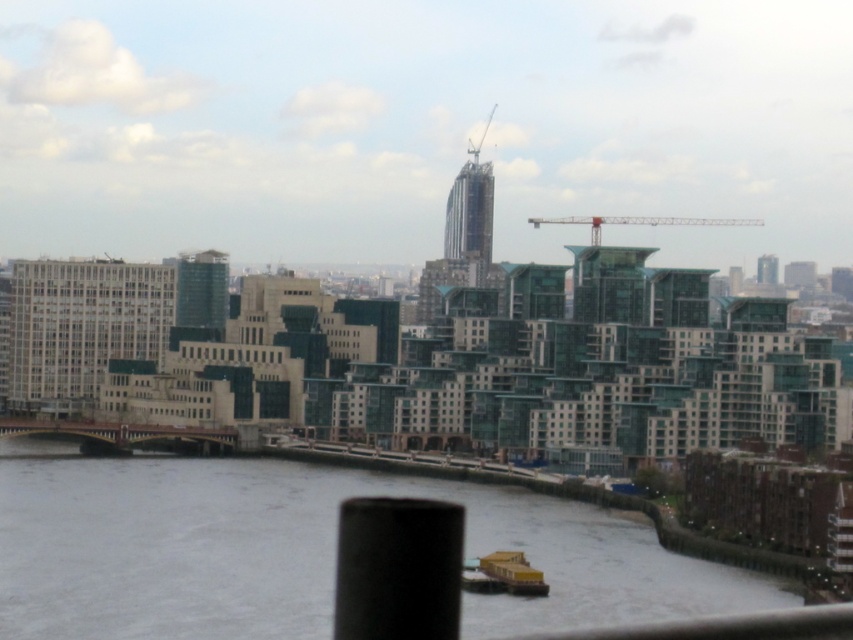
In the scene shown: Can you confirm if gray water at lower center is positioned above metallic red crane at upper center?

Actually, gray water at lower center is below metallic red crane at upper center.

Is gray water at lower center shorter than metallic red crane at upper center?

In fact, gray water at lower center may be taller than metallic red crane at upper center.

Looking at this image, who is more distant from viewer, (326, 516) or (708, 218)?

The point (708, 218) is more distant.

The width and height of the screenshot is (853, 640). What are the coordinates of `gray water at lower center` in the screenshot? It's located at (303, 552).

Is metallic red crane at upper center further to the viewer compared to metallic gray crane at upper center?

Yes, metallic red crane at upper center is behind metallic gray crane at upper center.

Does metallic red crane at upper center have a lesser width compared to metallic gray crane at upper center?

No, metallic red crane at upper center is not thinner than metallic gray crane at upper center.

What do you see at coordinates (639, 221) in the screenshot?
I see `metallic red crane at upper center` at bounding box center [639, 221].

In order to click on metallic red crane at upper center in this screenshot , I will do `click(639, 221)`.

Can you confirm if gray water at lower center is positioned to the right of metallic gray crane at upper center?

Incorrect, gray water at lower center is not on the right side of metallic gray crane at upper center.

Which is behind, point (299, 516) or point (471, 154)?

Point (471, 154)

Measure the distance between gray water at lower center and camera.

gray water at lower center and camera are 650.36 meters apart.

The height and width of the screenshot is (640, 853). In order to click on gray water at lower center in this screenshot , I will do `click(303, 552)`.